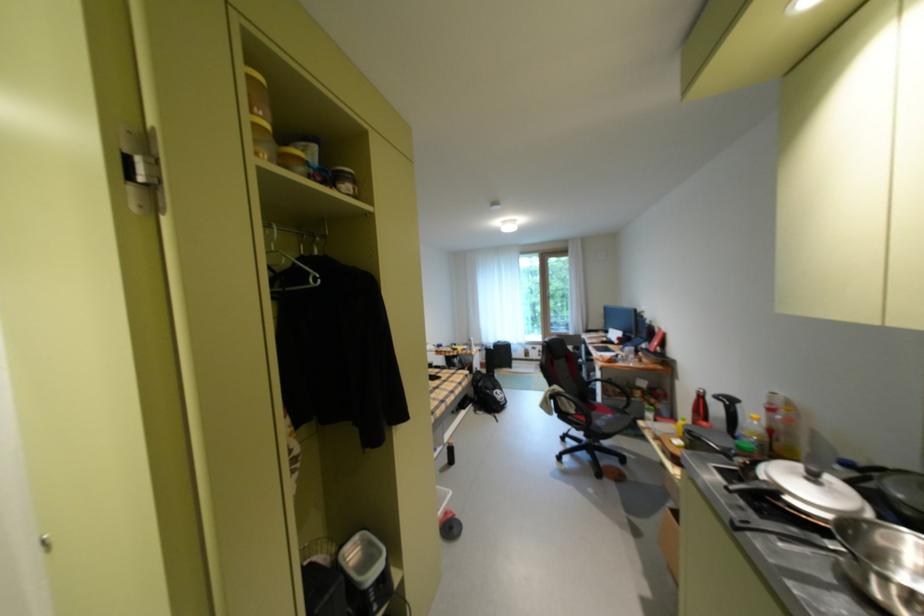
Describe the element at coordinates (768, 512) in the screenshot. I see `the black pan handle` at that location.